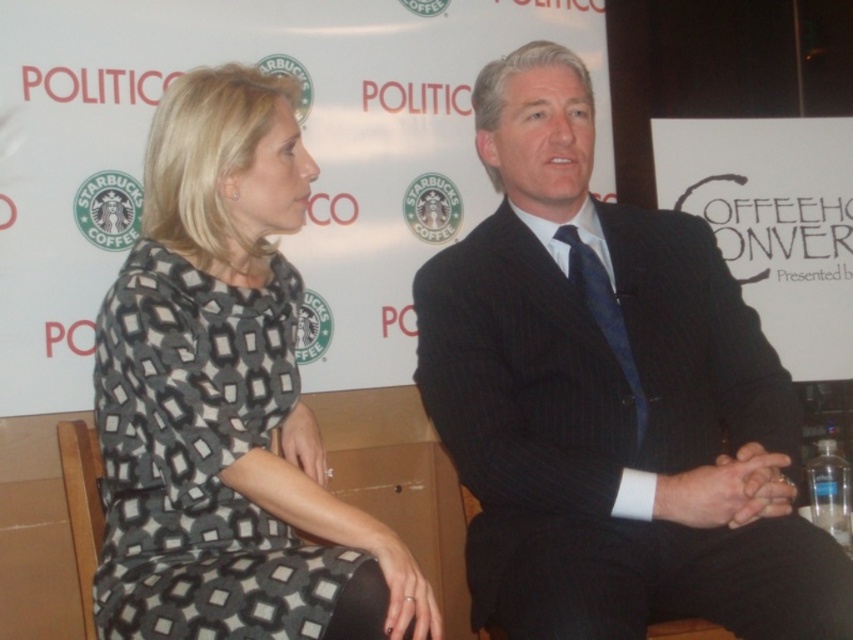
You are a photographer setting up a shoot for a magazine cover. You need to ensure that the black pinstripe suit at center and the printed fabric dress at center are visible in the frame. Based on their heights, which one might require adjusting the camera angle to avoid being obscured?

The black pinstripe suit at center is taller than the printed fabric dress at center, so the printed fabric dress at center might be partially obscured if not adjusted. Lowering the camera angle could help ensure both are visible.